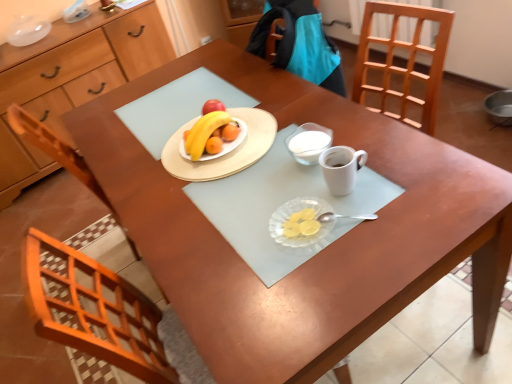
Identify the location of vacant space that is to the left of white matte coffee cup at center. The height and width of the screenshot is (384, 512). (275, 200).